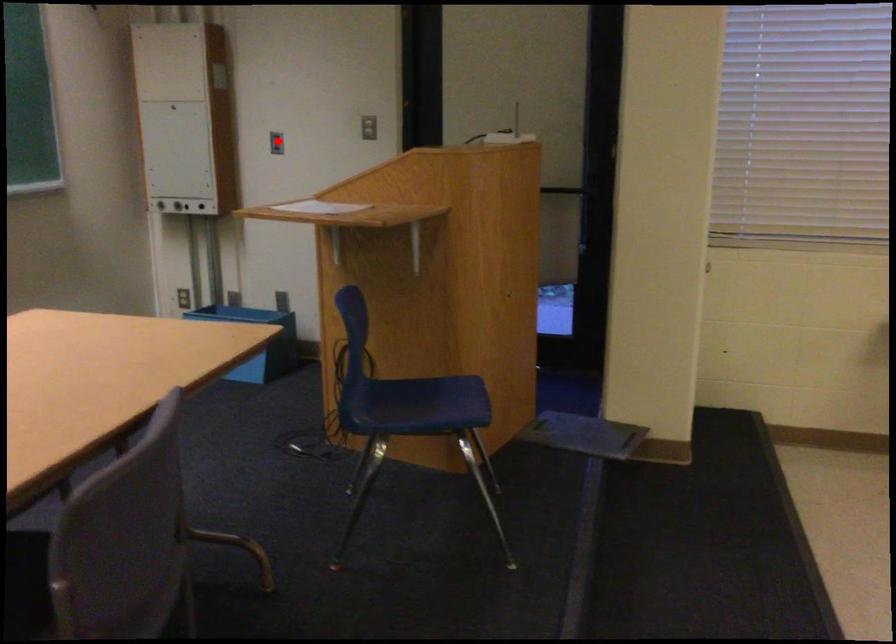
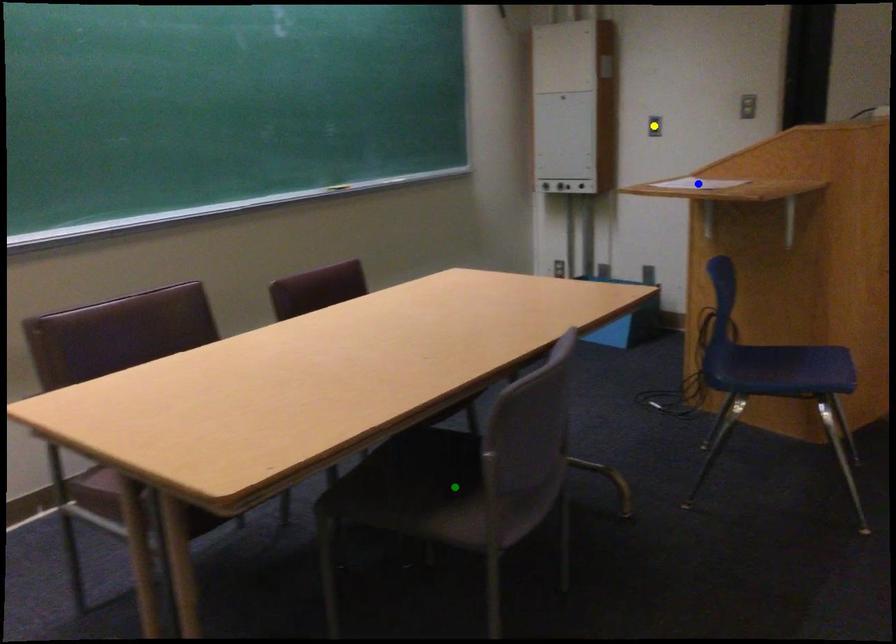
Question: I am providing you with two images of the same scene from different viewpoints. A red point is marked on the first image. You are given multiple points on the second image. Which point in image 2 represents the same 3d spot as the red point in image 1?

Choices:
 (A) green point
 (B) blue point
 (C) yellow point

Answer: (C)